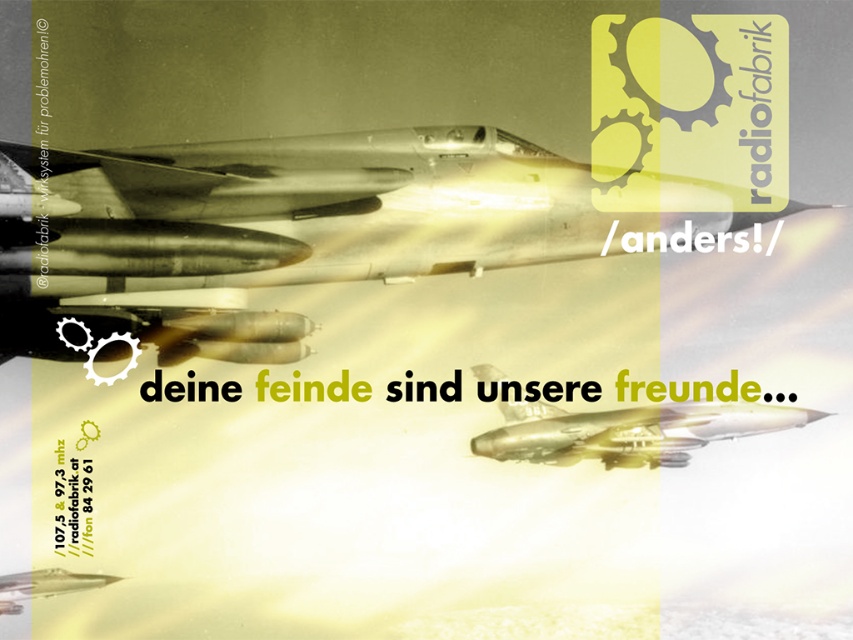
Is point (410, 256) farther from viewer compared to point (534, 412)?

Yes, point (410, 256) is behind point (534, 412).

Who is positioned more to the right, metallic silver plane at center or metallic gold airplane at center?

metallic gold airplane at center is more to the right.

Does point (322, 147) come closer to viewer compared to point (576, 458)?

Yes, point (322, 147) is closer to viewer.

You are a GUI agent. You are given a task and a screenshot of the screen. Output one action in this format:
    pyautogui.click(x=<x>, y=<y>)
    Task: Click on the metallic silver plane at center
    This screenshot has width=853, height=640.
    Given the screenshot: What is the action you would take?
    pyautogui.click(x=310, y=216)